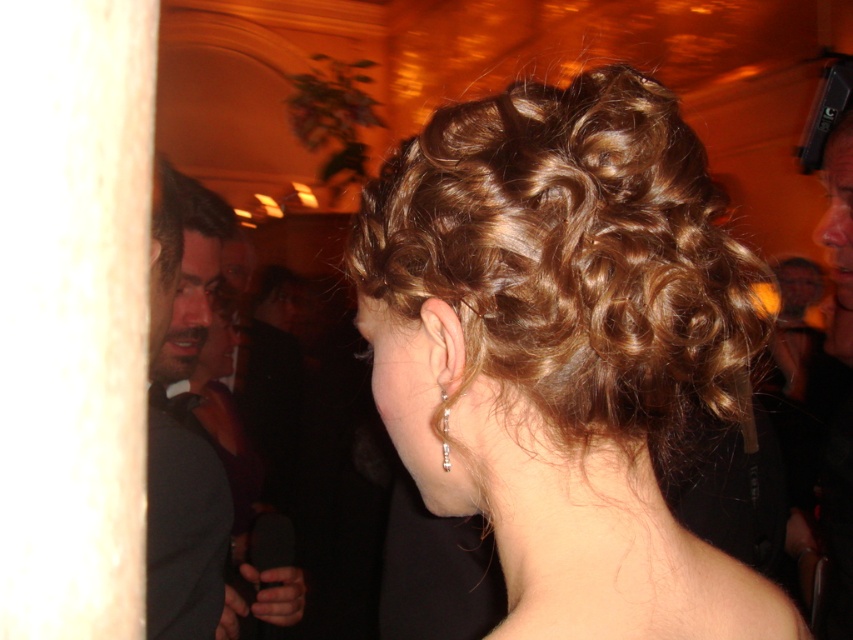
You are an artist trying to sketch the scene. The shiny brown hair at center is crucial for your drawing. Can you confirm its position in the image using coordinates?

The shiny brown hair at center is located at coordinates 0.545 on the x axis and 0.662 on the y axis.

You are a photographer at a formal event. You need to capture a close shot of the shiny brown hair at center and the shiny black suit at left. Since the camera can only focus on one object at a time, which object should you choose to ensure it fills more of the frame?

The shiny black suit at left has a greater width than the shiny brown hair at center, so choosing it will fill more of the frame.

You are at a formal event and notice two items in the scene. One is the shiny brown hair at center and the other is the shiny black suit at left. Which item is positioned to the right of the other?

The shiny brown hair at center is positioned to the right of the shiny black suit at left according to the description.